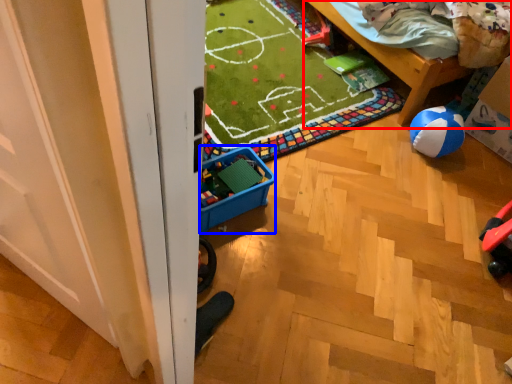
Question: Among these objects, which one is farthest to the camera, furniture (highlighted by a red box) or storage box (highlighted by a blue box)?

Choices:
 (A) furniture
 (B) storage box

Answer: (A)